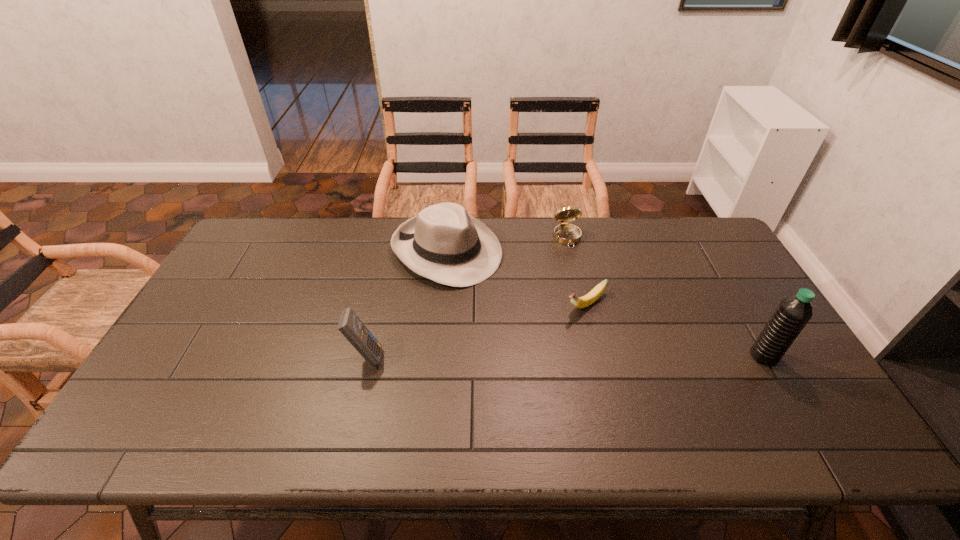
The width and height of the screenshot is (960, 540). Identify the location of calculator. (353, 329).

Where is `the rightmost object`? the rightmost object is located at coordinates (793, 313).

Find the location of a particular element. the tallest object is located at coordinates coord(793,313).

Find the location of a particular element. banana is located at coordinates (580, 302).

Where is `the third nearest object`? The height and width of the screenshot is (540, 960). the third nearest object is located at coordinates (580, 302).

I want to click on fedora, so click(443, 243).

You are a GUI agent. You are given a task and a screenshot of the screen. Output one action in this format:
    pyautogui.click(x=<x>, y=<y>)
    Task: Click on the second shortest object
    The width and height of the screenshot is (960, 540).
    Given the screenshot: What is the action you would take?
    pyautogui.click(x=565, y=233)

Find the location of a particular element. The width and height of the screenshot is (960, 540). vacant space located on the front-facing side of the calculator is located at coordinates tap(475, 356).

Image resolution: width=960 pixels, height=540 pixels. Identify the location of free spot located on the right of the rightmost object. (796, 356).

Identify the location of free space located at the stem of the third nearest object. (476, 381).